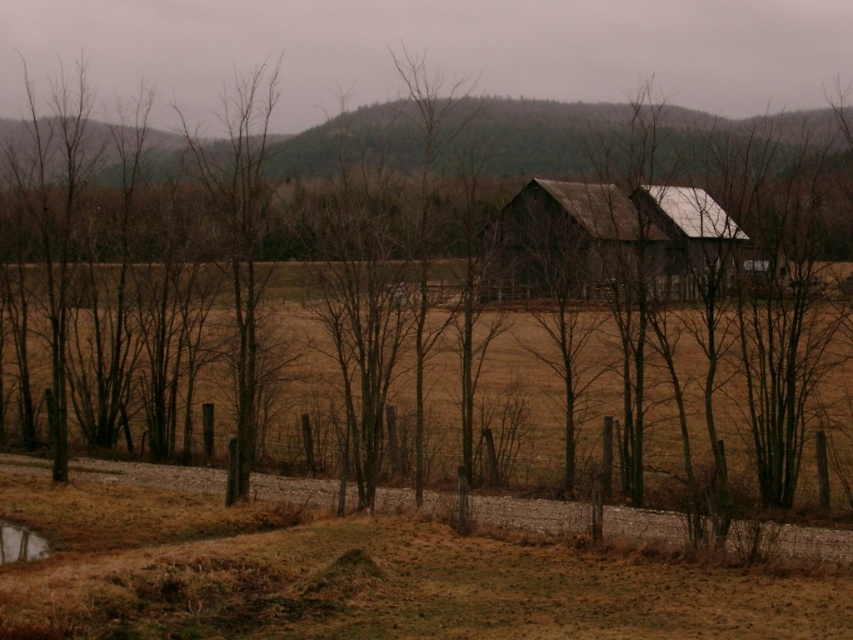
Question: Is rusty metal barn at center bigger than reflective wet surface at lower left?

Choices:
 (A) no
 (B) yes

Answer: (A)

Question: Which point appears farthest from the camera in this image?

Choices:
 (A) (624, 230)
 (B) (19, 554)

Answer: (A)

Question: Does rusty metal barn at center appear on the right side of reflective wet surface at lower left?

Choices:
 (A) no
 (B) yes

Answer: (B)

Question: Is rusty metal barn at center wider than reflective wet surface at lower left?

Choices:
 (A) no
 (B) yes

Answer: (A)